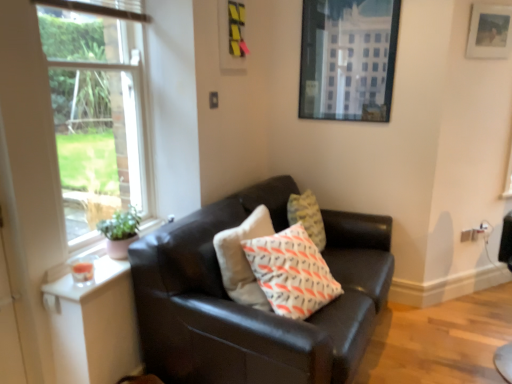
This screenshot has width=512, height=384. Describe the element at coordinates (96, 111) in the screenshot. I see `clear glass window at upper left` at that location.

I want to click on wooden picture frame at upper right, which appears as the 1th picture frame when viewed from the right, so click(490, 32).

The width and height of the screenshot is (512, 384). I want to click on metallic glass picture frame at upper right, the 2th picture frame viewed from the right, so [348, 59].

Locate an element on the screen. This screenshot has height=384, width=512. clear glass window at upper left is located at coordinates (96, 111).

Is matte black couch at center bigger or smaller than clear glass window at upper left?

matte black couch at center is bigger than clear glass window at upper left.

From a real-world perspective, is matte black couch at center physically below clear glass window at upper left?

Yes, from a real-world perspective, matte black couch at center is below clear glass window at upper left.

Could you tell me if matte black couch at center is turned towards clear glass window at upper left?

No, matte black couch at center is not aimed at clear glass window at upper left.

Would you say clear glass window at upper left is part of matte black couch at center's contents?

Actually, clear glass window at upper left is outside matte black couch at center.

Which is closer, (82, 208) or (316, 58)?

Point (82, 208) is farther from the camera than point (316, 58).

Locate an element on the screen. The image size is (512, 384). the 2nd picture frame behind the clear glass window at upper left, counting from the anchor's position is located at coordinates (x=348, y=59).

Is clear glass window at upper left thinner than metallic glass picture frame at upper right, the 2th picture frame viewed from the right?

In fact, clear glass window at upper left might be wider than metallic glass picture frame at upper right, the 2th picture frame viewed from the right.

Are wooden picture frame at upper right, which appears as the 1th picture frame when viewed from the right, and metallic glass picture frame at upper right, the 2th picture frame viewed from the right, beside each other?

No, wooden picture frame at upper right, which appears as the 1th picture frame when viewed from the right, is not making contact with metallic glass picture frame at upper right, the 2th picture frame viewed from the right.

Where is `picture frame that is behind the wooden picture frame at upper right, which appears as the 1th picture frame when viewed from the right`? This screenshot has width=512, height=384. picture frame that is behind the wooden picture frame at upper right, which appears as the 1th picture frame when viewed from the right is located at coordinates (348, 59).

Which object is positioned more to the left, wooden picture frame at upper right, marked as the second picture frame in a left-to-right arrangement, or metallic glass picture frame at upper right, marked as the 1th picture frame in a left-to-right arrangement?

metallic glass picture frame at upper right, marked as the 1th picture frame in a left-to-right arrangement, is more to the left.

Can you confirm if wooden picture frame at upper right, marked as the second picture frame in a left-to-right arrangement, is taller than metallic glass picture frame at upper right, marked as the 1th picture frame in a left-to-right arrangement?

Incorrect, the height of wooden picture frame at upper right, marked as the second picture frame in a left-to-right arrangement, is not larger of that of metallic glass picture frame at upper right, marked as the 1th picture frame in a left-to-right arrangement.

Is white cotton pillow at center to the right of clear glass window at upper left from the viewer's perspective?

Indeed, white cotton pillow at center is positioned on the right side of clear glass window at upper left.

Can clear glass window at upper left be found inside white cotton pillow at center?

No, clear glass window at upper left is located outside of white cotton pillow at center.

From the image's perspective, between white cotton pillow at center and clear glass window at upper left, which one is located above?

clear glass window at upper left.

Considering the points (282, 279) and (52, 65), which point is in front, point (282, 279) or point (52, 65)?

The point (52, 65) is more forward.

Which is more to the left, metallic glass picture frame at upper right, the 2th picture frame viewed from the right, or clear glass window at upper left?

Positioned to the left is clear glass window at upper left.

Does metallic glass picture frame at upper right, the 2th picture frame viewed from the right, have a greater height compared to clear glass window at upper left?

No.

Which is behind, metallic glass picture frame at upper right, the 2th picture frame viewed from the right, or clear glass window at upper left?

metallic glass picture frame at upper right, the 2th picture frame viewed from the right, is further from the camera.

Between metallic glass picture frame at upper right, marked as the 1th picture frame in a left-to-right arrangement, and clear glass window at upper left, which one has larger size?

clear glass window at upper left.

Can you confirm if wooden picture frame at upper right, marked as the second picture frame in a left-to-right arrangement, is thinner than white cotton pillow at center?

Indeed, wooden picture frame at upper right, marked as the second picture frame in a left-to-right arrangement, has a lesser width compared to white cotton pillow at center.

Can you confirm if wooden picture frame at upper right, which appears as the 1th picture frame when viewed from the right, is positioned to the right of white cotton pillow at center?

Correct, you'll find wooden picture frame at upper right, which appears as the 1th picture frame when viewed from the right, to the right of white cotton pillow at center.

Which object is further away from the camera taking this photo, wooden picture frame at upper right, which appears as the 1th picture frame when viewed from the right, or white cotton pillow at center?

Positioned behind is wooden picture frame at upper right, which appears as the 1th picture frame when viewed from the right.

Does matte black couch at center have a greater width compared to metallic glass picture frame at upper right, the 2th picture frame viewed from the right?

Correct, the width of matte black couch at center exceeds that of metallic glass picture frame at upper right, the 2th picture frame viewed from the right.

Identify the location of studio couch below the metallic glass picture frame at upper right, the 2th picture frame viewed from the right (from the image's perspective). (251, 308).

Is matte black couch at center shorter than metallic glass picture frame at upper right, marked as the 1th picture frame in a left-to-right arrangement?

No, matte black couch at center is not shorter than metallic glass picture frame at upper right, marked as the 1th picture frame in a left-to-right arrangement.

The image size is (512, 384). I want to click on window above the matte black couch at center (from the image's perspective), so click(x=96, y=111).

At what (x,y) coordinates should I click in order to perform the action: click on window directly beneath the metallic glass picture frame at upper right, the 2th picture frame viewed from the right (from a real-world perspective). Please return your answer as a coordinate pair (x, y). Looking at the image, I should click on (96, 111).

Estimate the real-world distances between objects in this image. Which object is closer to metallic glass picture frame at upper right, marked as the 1th picture frame in a left-to-right arrangement, white cotton pillow at center or matte black couch at center?

matte black couch at center is closer to metallic glass picture frame at upper right, marked as the 1th picture frame in a left-to-right arrangement.

From the image, which object appears to be nearer to wooden picture frame at upper right, which appears as the 1th picture frame when viewed from the right, clear glass window at upper left or metallic glass picture frame at upper right, marked as the 1th picture frame in a left-to-right arrangement?

Based on the image, metallic glass picture frame at upper right, marked as the 1th picture frame in a left-to-right arrangement, appears to be nearer to wooden picture frame at upper right, which appears as the 1th picture frame when viewed from the right.

Looking at the image, which one is located closer to wooden picture frame at upper right, marked as the second picture frame in a left-to-right arrangement, white cotton pillow at center or clear glass window at upper left?

Based on the image, white cotton pillow at center appears to be nearer to wooden picture frame at upper right, marked as the second picture frame in a left-to-right arrangement.

Considering their positions, is clear glass window at upper left positioned closer to matte black couch at center than metallic glass picture frame at upper right, marked as the 1th picture frame in a left-to-right arrangement?

clear glass window at upper left.

Based on their spatial positions, is white cotton pillow at center or metallic glass picture frame at upper right, marked as the 1th picture frame in a left-to-right arrangement, closer to wooden picture frame at upper right, which appears as the 1th picture frame when viewed from the right?

Among the two, metallic glass picture frame at upper right, marked as the 1th picture frame in a left-to-right arrangement, is located nearer to wooden picture frame at upper right, which appears as the 1th picture frame when viewed from the right.

Estimate the real-world distances between objects in this image. Which object is closer to wooden picture frame at upper right, marked as the second picture frame in a left-to-right arrangement, metallic glass picture frame at upper right, the 2th picture frame viewed from the right, or clear glass window at upper left?

The object closer to wooden picture frame at upper right, marked as the second picture frame in a left-to-right arrangement, is metallic glass picture frame at upper right, the 2th picture frame viewed from the right.

Which object lies nearer to the anchor point wooden picture frame at upper right, marked as the second picture frame in a left-to-right arrangement, clear glass window at upper left or white cotton pillow at center?

The object closer to wooden picture frame at upper right, marked as the second picture frame in a left-to-right arrangement, is white cotton pillow at center.

Which object lies nearer to the anchor point white cotton pillow at center, wooden picture frame at upper right, which appears as the 1th picture frame when viewed from the right, or matte black couch at center?

matte black couch at center.

Locate an element on the screen. The image size is (512, 384). pillow situated between clear glass window at upper left and metallic glass picture frame at upper right, marked as the 1th picture frame in a left-to-right arrangement, from left to right is located at coordinates (291, 272).

Where is `pillow between metallic glass picture frame at upper right, marked as the 1th picture frame in a left-to-right arrangement, and matte black couch at center vertically`? This screenshot has height=384, width=512. pillow between metallic glass picture frame at upper right, marked as the 1th picture frame in a left-to-right arrangement, and matte black couch at center vertically is located at coordinates (291, 272).

You are a GUI agent. You are given a task and a screenshot of the screen. Output one action in this format:
    pyautogui.click(x=<x>, y=<y>)
    Task: Click on the pillow between wooden picture frame at upper right, marked as the second picture frame in a left-to-right arrangement, and matte black couch at center in the up-down direction
    
    Given the screenshot: What is the action you would take?
    pyautogui.click(x=291, y=272)

I want to click on picture frame between wooden picture frame at upper right, marked as the second picture frame in a left-to-right arrangement, and white cotton pillow at center, in the vertical direction, so click(348, 59).